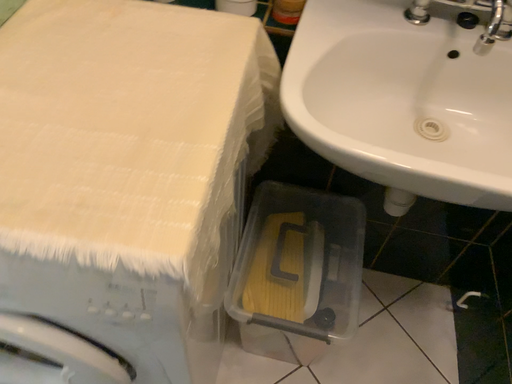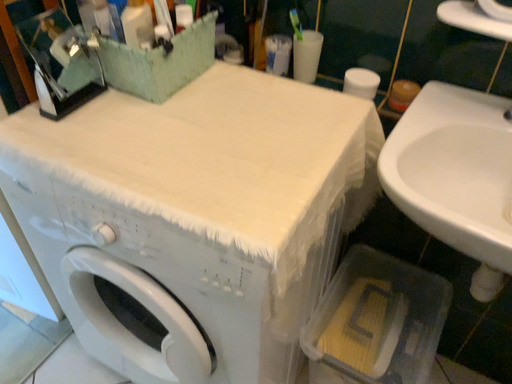
Question: Which way did the camera rotate in the video?

Choices:
 (A) rotated left
 (B) rotated right

Answer: (A)